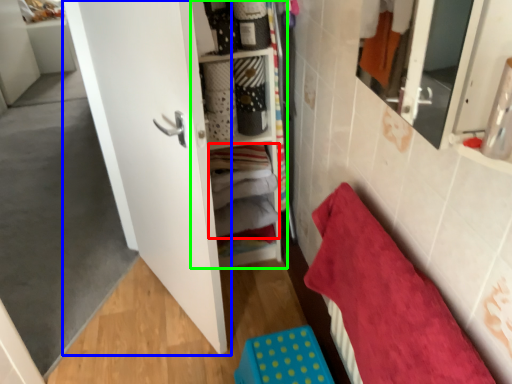
Question: Which object is the farthest from laundry (highlighted by a red box)? Choose among these: door (highlighted by a blue box) or cabinet (highlighted by a green box).

Choices:
 (A) door
 (B) cabinet

Answer: (A)